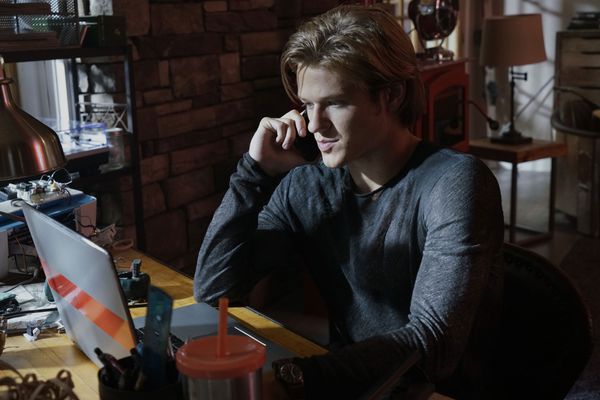
In order to click on thermal cup in this screenshot , I will do `click(238, 381)`.